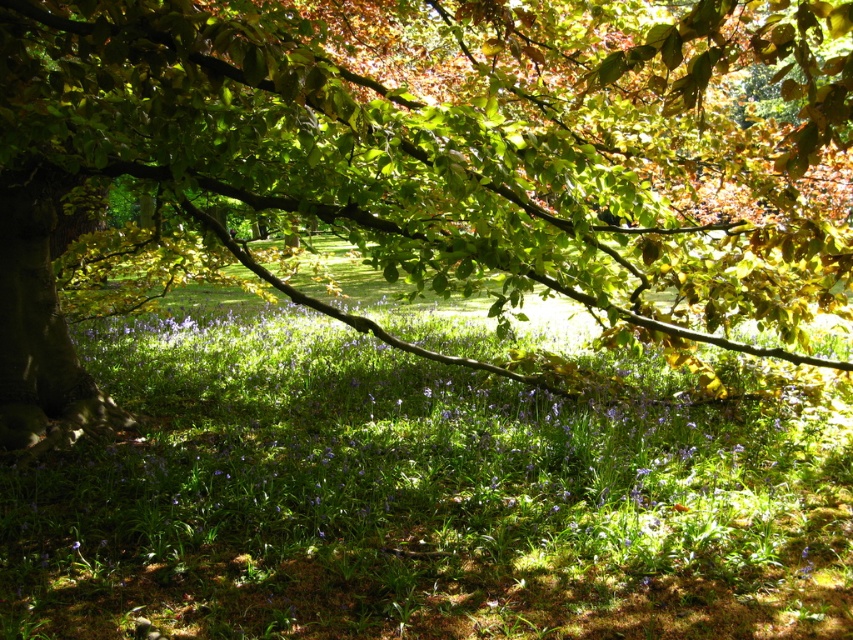
You are a photographer standing in the woodland scene and want to take a photo that includes both the point at coordinates (375, 68) and the point at coordinates (339, 412). Since you want the closer object to be in focus, which point should you focus on?

You should focus on point (339, 412) because it is closer to you than point (375, 68), so focusing on the closer point will ensure it is in sharp focus while the background may blur slightly.

You are standing in the woodland scene and want to locate the point at coordinates point (x=431, y=161). Which object in the scene is this point located on?

The point (x=431, y=161) is located on the green leafy tree at upper left.

You are a hiker standing in the woodland scene. You notice the green leafy tree at upper left and the green leafy grass at center. Which object is taller?

The green leafy tree at upper left is taller than the green leafy grass at center.